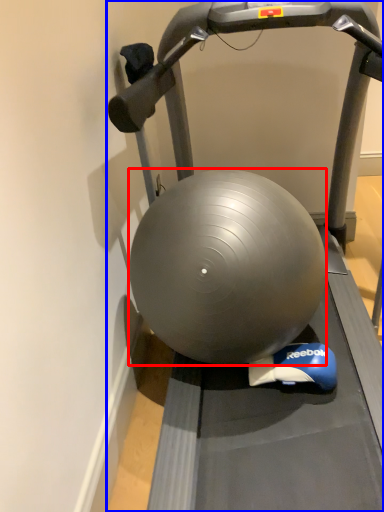
Question: Which of the following is the closest to the observer, ball (highlighted by a red box) or treadmill (highlighted by a blue box)?

Choices:
 (A) ball
 (B) treadmill

Answer: (B)